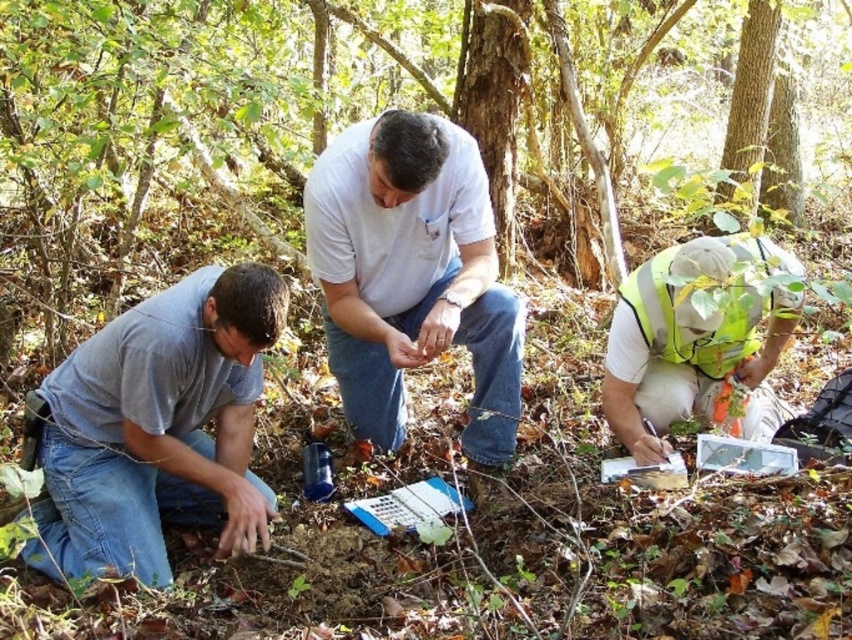
Which is in front, point (99, 506) or point (698, 256)?

Positioned in front is point (99, 506).

Can you confirm if gray matte shirt at lower left is wider than reflective yellow vest at lower right?

Yes, gray matte shirt at lower left is wider than reflective yellow vest at lower right.

Where is `gray matte shirt at lower left`? Image resolution: width=852 pixels, height=640 pixels. gray matte shirt at lower left is located at coordinates (156, 428).

Locate an element on the screen. Image resolution: width=852 pixels, height=640 pixels. gray matte shirt at lower left is located at coordinates (156, 428).

Is white matte shirt at center shorter than reflective yellow vest at lower right?

No.

Can you confirm if white matte shirt at center is positioned to the right of reflective yellow vest at lower right?

Incorrect, white matte shirt at center is not on the right side of reflective yellow vest at lower right.

Does point (396, 136) lie in front of point (787, 269)?

Yes, point (396, 136) is closer to viewer.

Where is `white matte shirt at center`? Image resolution: width=852 pixels, height=640 pixels. white matte shirt at center is located at coordinates (412, 275).

Consider the image. Is gray matte shirt at lower left behind white matte shirt at center?

No, gray matte shirt at lower left is in front of white matte shirt at center.

Is point (269, 333) closer to camera compared to point (373, 388)?

Yes, point (269, 333) is in front of point (373, 388).

The height and width of the screenshot is (640, 852). In order to click on gray matte shirt at lower left in this screenshot , I will do `click(156, 428)`.